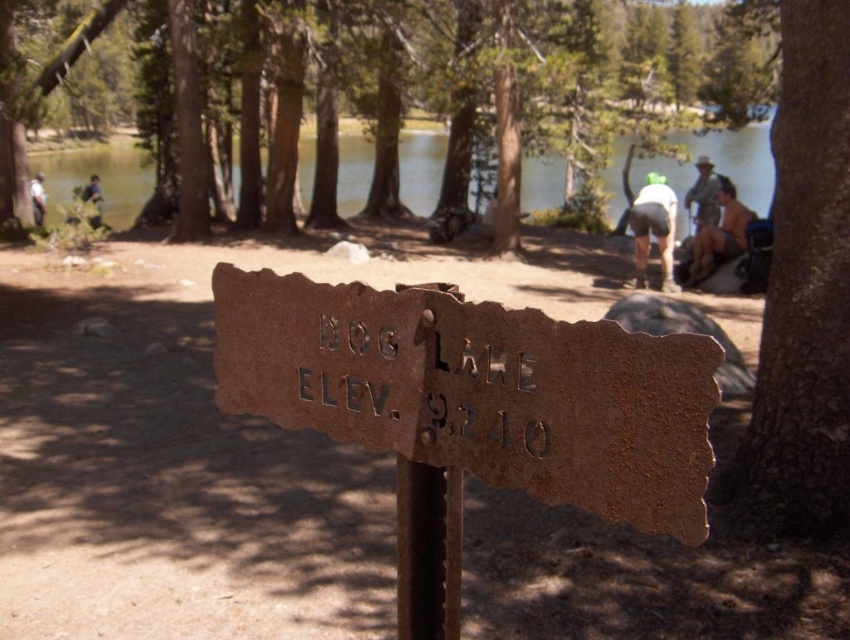
Question: Which object appears farthest from the camera in this image?

Choices:
 (A) rusty metal sign at center
 (B) tan skin person at right
 (C) white matte shorts at center
 (D) clear water at lake center

Answer: (D)

Question: Which point is closer to the camera taking this photo?

Choices:
 (A) (706, 168)
 (B) (89, 180)
 (C) (721, 260)

Answer: (C)

Question: Is clear water at lake center positioned behind brown textured tree at center?

Choices:
 (A) yes
 (B) no

Answer: (A)

Question: Which object is positioned farthest from the green fabric backpack at upper left?

Choices:
 (A) camouflage jacket at upper right
 (B) brown textured tree at center
 (C) brown rough bark tree at right
 (D) clear water at lake center

Answer: (C)

Question: Does clear water at lake center have a greater width compared to green fabric backpack at upper left?

Choices:
 (A) no
 (B) yes

Answer: (B)

Question: Can you confirm if white matte shorts at center is wider than brushed metal backpack at upper left?

Choices:
 (A) yes
 (B) no

Answer: (B)